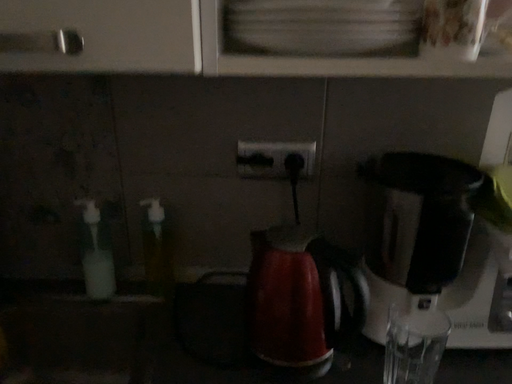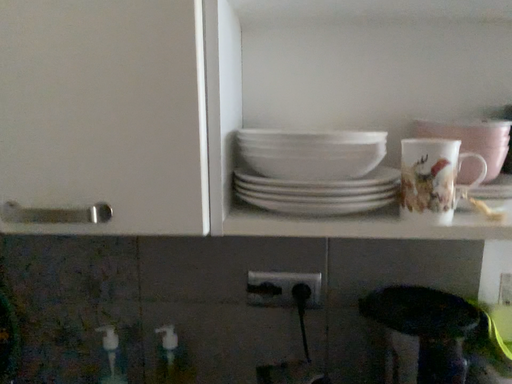
Question: How did the camera likely rotate when shooting the video?

Choices:
 (A) rotated downward
 (B) rotated upward

Answer: (B)